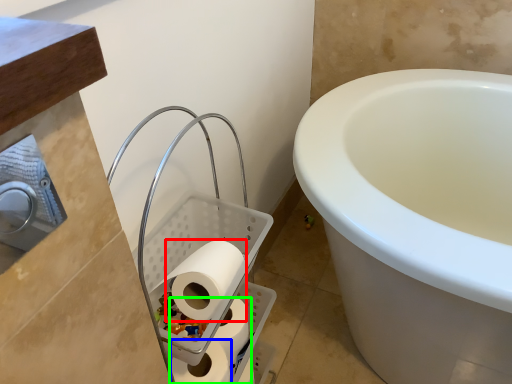
Question: Which is nearer to the toilet paper (highlighted by a red box)? toilet paper (highlighted by a blue box) or toilet paper (highlighted by a green box).

Choices:
 (A) toilet paper
 (B) toilet paper

Answer: (A)